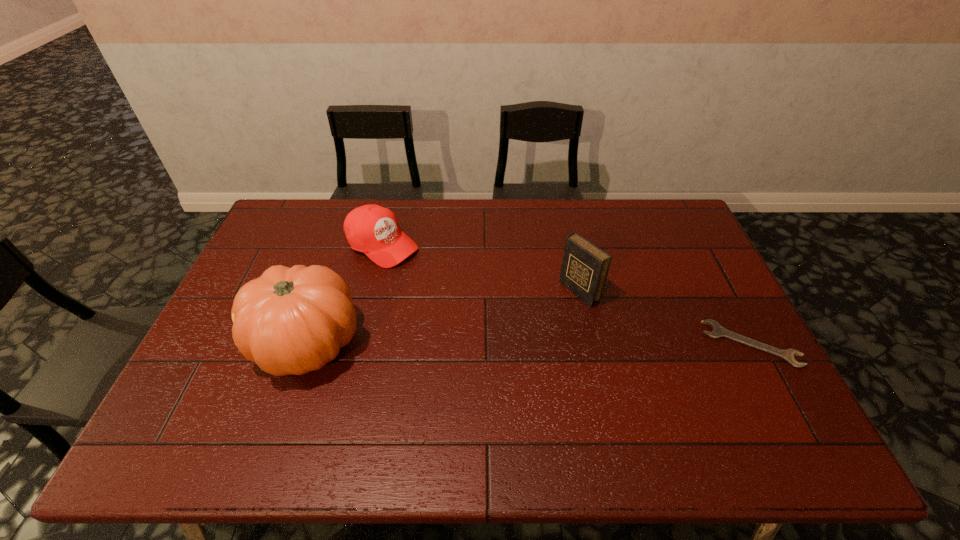
What are the coordinates of `free space between the baseball cap and the shortest object` in the screenshot? It's located at (566, 294).

I want to click on free space between the farthest object and the third object from left to right, so click(480, 268).

This screenshot has width=960, height=540. I want to click on vacant space in between the second tallest object and the tallest object, so click(444, 319).

Identify which object is the third nearest to the pumpkin. Please provide its 2D coordinates. Your answer should be formatted as a tuple, i.e. [(x, y)], where the tuple contains the x and y coordinates of a point satisfying the conditions above.

[(718, 331)]

Image resolution: width=960 pixels, height=540 pixels. What are the coordinates of `object identified as the second closest to the tallest object` in the screenshot? It's located at (584, 269).